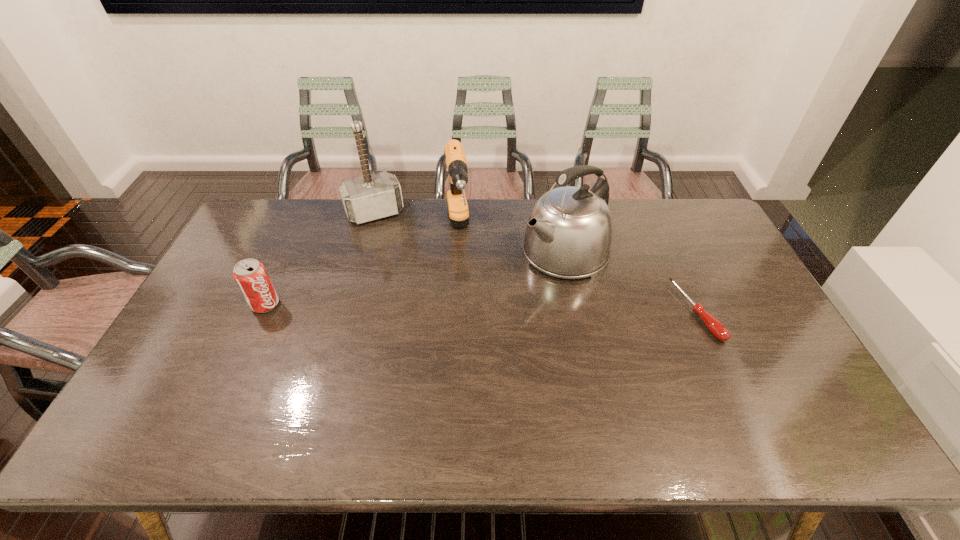
Find the location of a particular element. The width and height of the screenshot is (960, 540). the leftmost object is located at coordinates (251, 276).

This screenshot has width=960, height=540. I want to click on the fourth tallest object, so click(x=251, y=276).

The width and height of the screenshot is (960, 540). I want to click on the rightmost object, so click(x=714, y=326).

Identify the location of the shortest object. The height and width of the screenshot is (540, 960). (714, 326).

The height and width of the screenshot is (540, 960). I want to click on the third shortest object, so click(455, 158).

The width and height of the screenshot is (960, 540). I want to click on the third object from right to left, so click(x=455, y=158).

At what (x,y) coordinates should I click in order to perform the action: click on kettle. Please return your answer as a coordinate pair (x, y). This screenshot has height=540, width=960. Looking at the image, I should click on (568, 235).

Identify the location of the second object from left to right. This screenshot has width=960, height=540. (371, 197).

At what (x,y) coordinates should I click in order to perform the action: click on blank area located 0.140m on the front of the leftmost object. Please return your answer as a coordinate pair (x, y). The width and height of the screenshot is (960, 540). Looking at the image, I should click on (242, 355).

Where is `vacant position located on the left of the rightmost object`? The width and height of the screenshot is (960, 540). vacant position located on the left of the rightmost object is located at coordinates (597, 312).